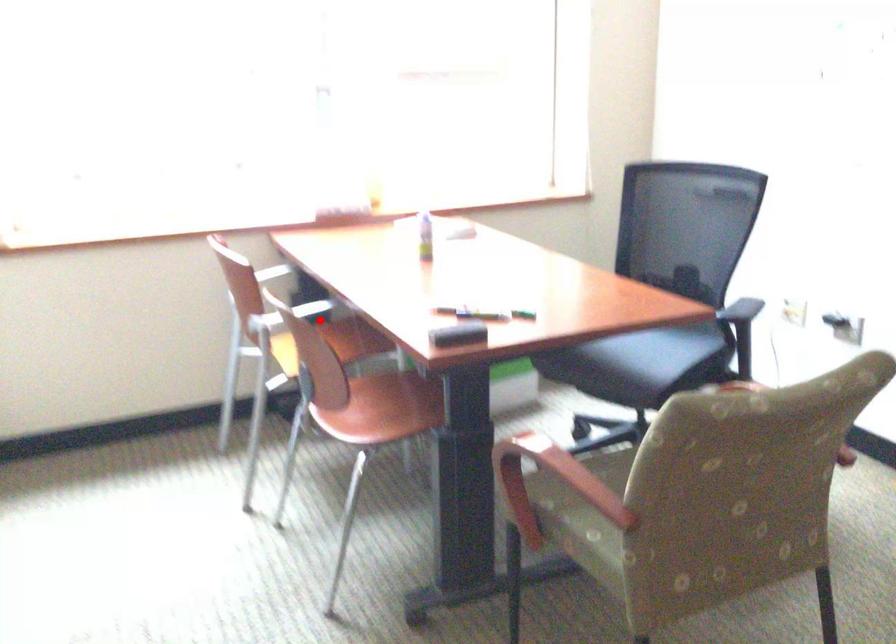
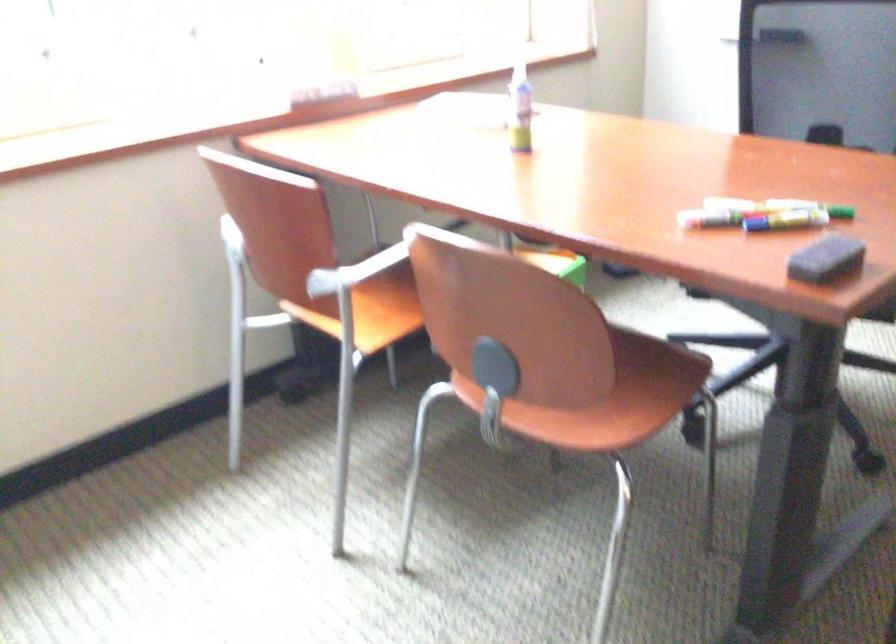
Question: I am providing you with two images of the same scene from different viewpoints. A red point is marked on the first image. At the location where the point appears in image 1, is it still visible in image 2?

Choices:
 (A) Yes
 (B) No

Answer: (B)